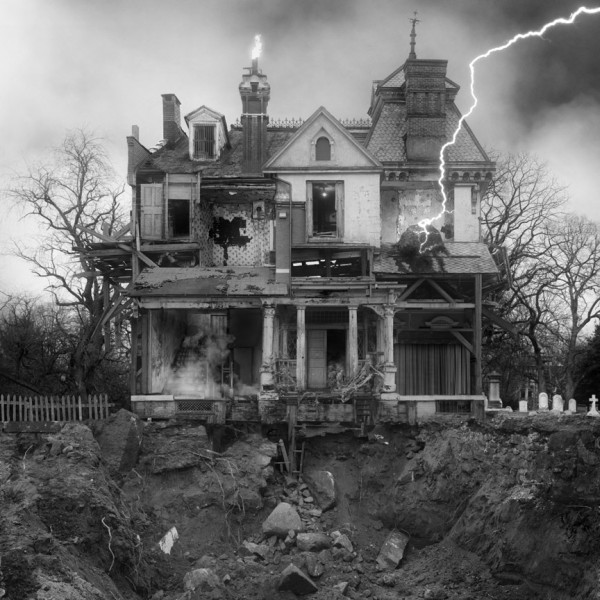
Where is `window`? The image size is (600, 600). window is located at coordinates (325, 214), (323, 144), (203, 135), (176, 217).